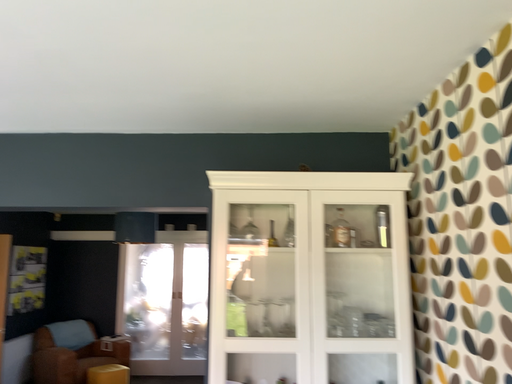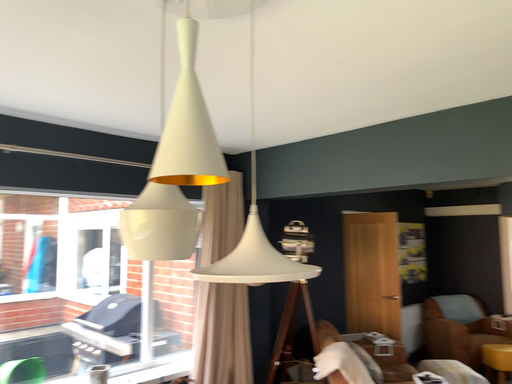
Question: How did the camera likely rotate when shooting the video?

Choices:
 (A) rotated upward
 (B) rotated downward

Answer: (B)